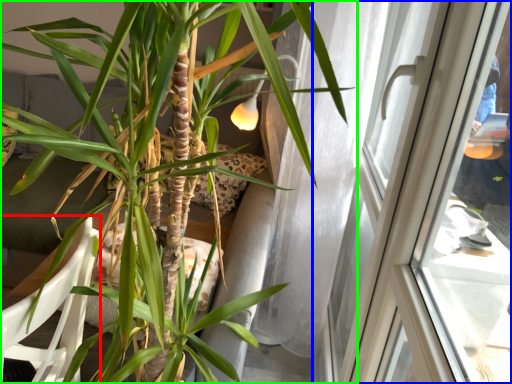
Question: Based on their relative distances, which object is farther from armchair (highlighted by a red box)? Choose from window (highlighted by a blue box) and houseplant (highlighted by a green box).

Choices:
 (A) window
 (B) houseplant

Answer: (A)